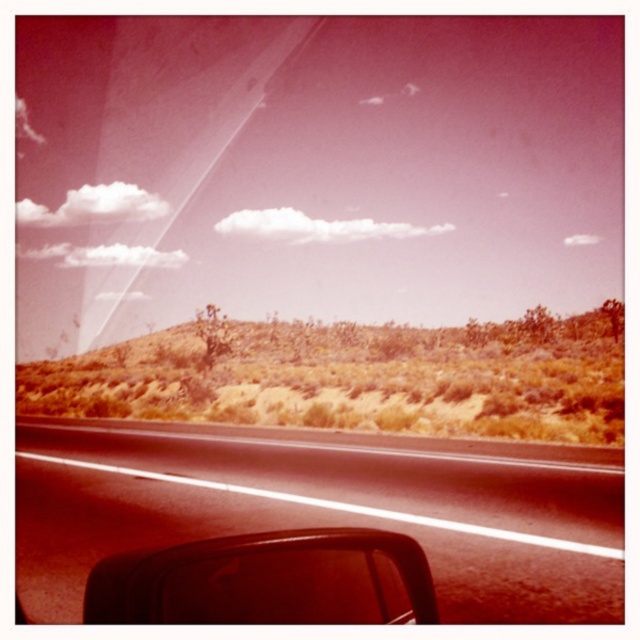
You are driving a car and want to know if the black asphalt road at center can fit the matte black view mirror at lower left in terms of width. Can it?

The black asphalt road at center is wider than the matte black view mirror at lower left, so yes, the road can accommodate the mirror in terms of width.